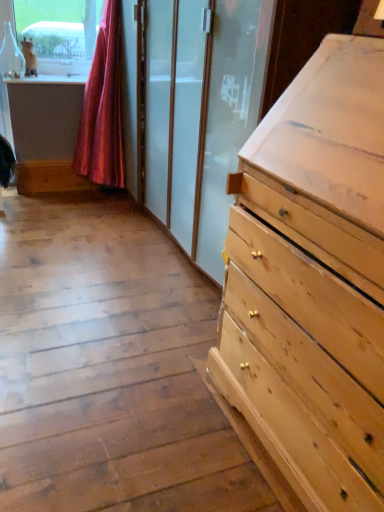
Find the location of `spots to the right of white fur cat at upper left`. spots to the right of white fur cat at upper left is located at coordinates (59, 81).